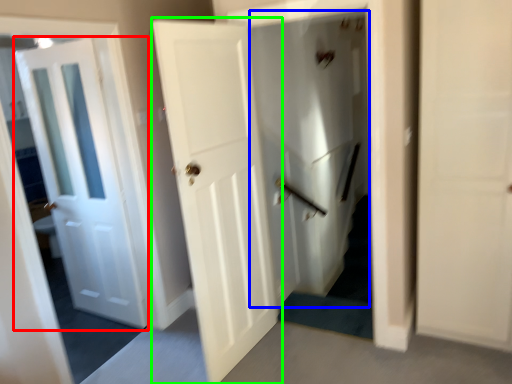
Question: Which object is positioned farthest from door (highlighted by a red box)? Select from elevator (highlighted by a blue box) and door (highlighted by a green box).

Choices:
 (A) elevator
 (B) door

Answer: (A)